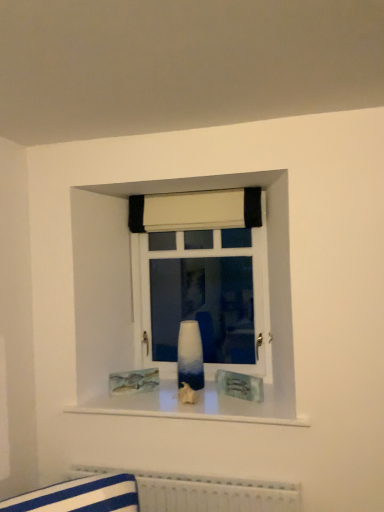
Question: Does white fabric curtain at upper center come in front of ombre glass vase at center?

Choices:
 (A) no
 (B) yes

Answer: (B)

Question: Is white fabric curtain at upper center thinner than ombre glass vase at center?

Choices:
 (A) yes
 (B) no

Answer: (B)

Question: Is white fabric curtain at upper center smaller than ombre glass vase at center?

Choices:
 (A) yes
 (B) no

Answer: (A)

Question: Are white fabric curtain at upper center and ombre glass vase at center located far from each other?

Choices:
 (A) yes
 (B) no

Answer: (B)

Question: Could you tell me if white fabric curtain at upper center is turned towards ombre glass vase at center?

Choices:
 (A) no
 (B) yes

Answer: (A)

Question: From a real-world perspective, is ombre glass vase at center above or below white textured radiator at lower center?

Choices:
 (A) above
 (B) below

Answer: (A)

Question: Is ombre glass vase at center in front of or behind white textured radiator at lower center in the image?

Choices:
 (A) front
 (B) behind

Answer: (B)

Question: Is ombre glass vase at center wider or thinner than white textured radiator at lower center?

Choices:
 (A) wide
 (B) thin

Answer: (B)

Question: From the image's perspective, is ombre glass vase at center above or below white textured radiator at lower center?

Choices:
 (A) above
 (B) below

Answer: (A)

Question: Is white fabric curtain at upper center taller or shorter than ombre glass vase at center?

Choices:
 (A) short
 (B) tall

Answer: (A)

Question: From the image's perspective, is white fabric curtain at upper center located above or below ombre glass vase at center?

Choices:
 (A) below
 (B) above

Answer: (B)

Question: In the image, is white fabric curtain at upper center positioned in front of or behind ombre glass vase at center?

Choices:
 (A) front
 (B) behind

Answer: (A)

Question: Choose the correct answer: Is white fabric curtain at upper center inside ombre glass vase at center or outside it?

Choices:
 (A) inside
 (B) outside

Answer: (B)

Question: Relative to ombre glass vase at center, is blue glossy vase at center in front or behind?

Choices:
 (A) behind
 (B) front

Answer: (B)

Question: Which is correct: blue glossy vase at center is inside ombre glass vase at center, or outside of it?

Choices:
 (A) inside
 (B) outside

Answer: (B)